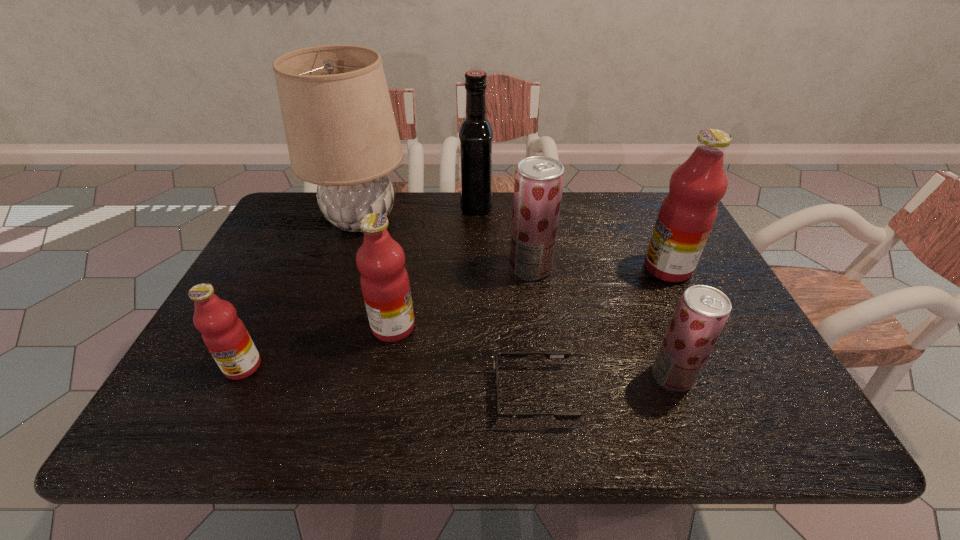
This screenshot has height=540, width=960. Find the location of `fruit juice that is the third closest to the tallest fruit juice`. fruit juice that is the third closest to the tallest fruit juice is located at coordinates (384, 280).

At what (x,y) coordinates should I click in order to perform the action: click on the closest pink fruit juice to the farthest pink fruit juice. Please return your answer as a coordinate pair (x, y). This screenshot has height=540, width=960. Looking at the image, I should click on (384, 280).

This screenshot has width=960, height=540. Identify the location of pink fruit juice that is the closest to the shortest object. (384, 280).

Locate an element on the screen. This screenshot has height=540, width=960. free spot that satisfies the following two spatial constraints: 1. on the label of the farthest pink fruit juice; 2. on the label of the nearest pink fruit juice is located at coordinates tap(715, 366).

I want to click on free space that satisfies the following two spatial constraints: 1. on the label of the smallest pink fruit juice; 2. on the left side of the smaller strawberry fruit juice, so click(x=238, y=376).

The width and height of the screenshot is (960, 540). I want to click on vacant position in the image that satisfies the following two spatial constraints: 1. on the label of the fourth fruit juice from right to left; 2. on the label of the smallest pink fruit juice, so 386,366.

At what (x,y) coordinates should I click in order to perform the action: click on vacant region that satisfies the following two spatial constraints: 1. on the label of the second fruit juice from left to right; 2. on the label of the nearest pink fruit juice. Please return your answer as a coordinate pair (x, y). The image size is (960, 540). Looking at the image, I should click on pos(386,366).